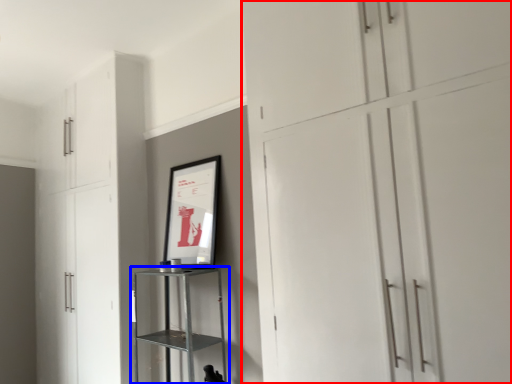
Question: Among these objects, which one is nearest to the camera, cupboard (highlighted by a red box) or shelf (highlighted by a blue box)?

Choices:
 (A) cupboard
 (B) shelf

Answer: (A)